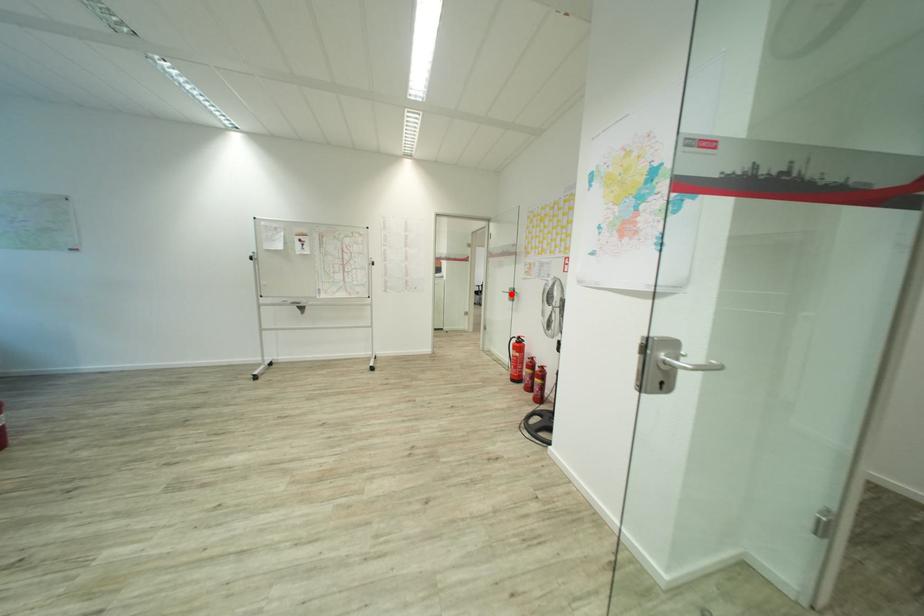
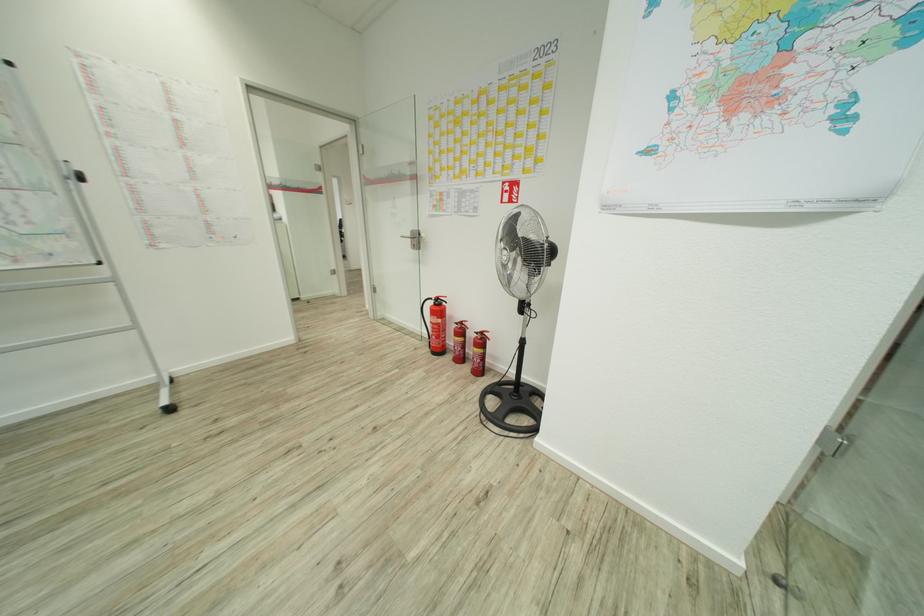
Where in the second image is the point corresponding to the highlighted location from the first image?

(416, 238)